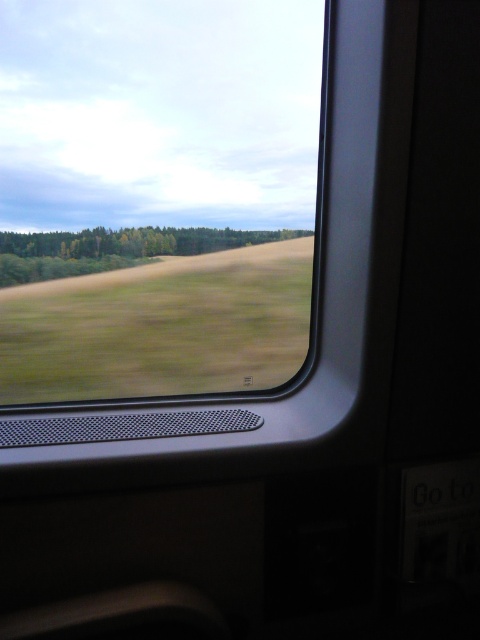
You are standing inside the train and want to know how far you are from the point marked at coordinates (243, 298). Can you determine the distance?

The point marked at coordinates (243, 298) is 4.89 meters away from the camera, so you are approximately 4.89 meters away from that point.

You are sitting in the train and want to look at the green matte forest at center outside. Since the transparent glass window at center is in your way, can you still see the forest through it?

Yes, the transparent glass window at center is to the left of green matte forest at center, so you can see the forest through the window since it is transparent.

You are a passenger sitting in the train and want to see the view outside. Which object, the transparent glass window at center or the green matte forest at center, allows you to see the outside scenery better?

The transparent glass window at center is much taller than the green matte forest at center, so it allows a better view of the outside scenery.